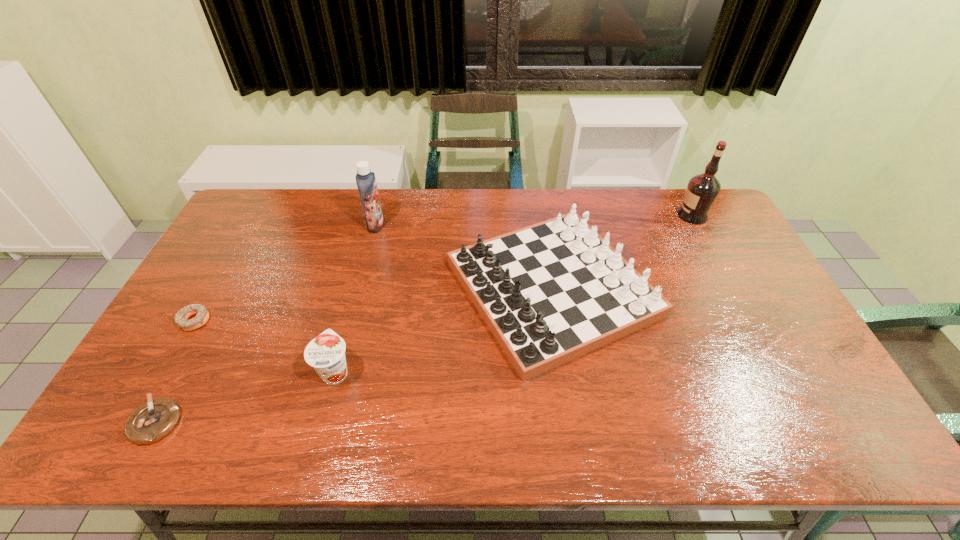
The image size is (960, 540). I want to click on object that can be found as the second closest to the doughnut, so pyautogui.click(x=326, y=353).

You are a GUI agent. You are given a task and a screenshot of the screen. Output one action in this format:
    pyautogui.click(x=<x>, y=<y>)
    Task: Click on the free location that satisfies the following two spatial constraints: 1. on the front label of the second tallest object; 2. on the front side of the doughnut
    The width and height of the screenshot is (960, 540).
    Given the screenshot: What is the action you would take?
    pyautogui.click(x=350, y=321)

Identify the location of vacant space that satisfies the following two spatial constraints: 1. on the surface of the tallest object; 2. on the front side of the nearest object. (803, 421).